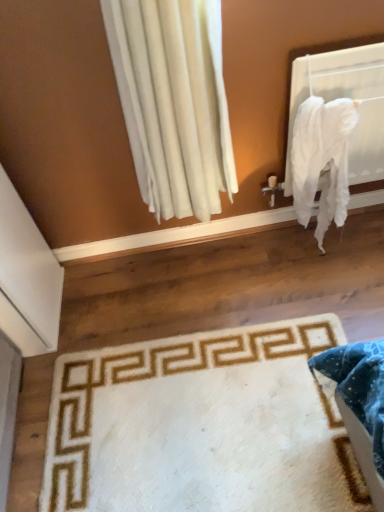
Identify the location of vacant location below white plush rug at lower center (from a real-world perspective). This screenshot has width=384, height=512. (206, 431).